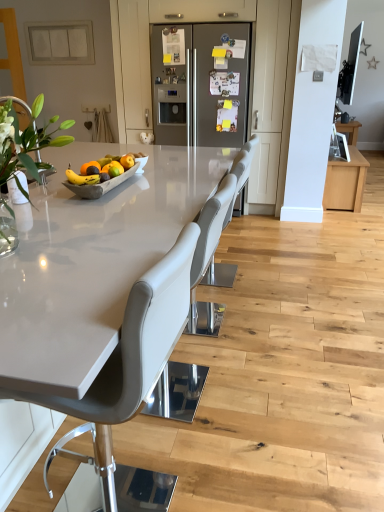
Locate an element on the screen. This screenshot has height=512, width=384. vacant area that is in front of gray leather chair at center, the second chair from the back is located at coordinates (184, 451).